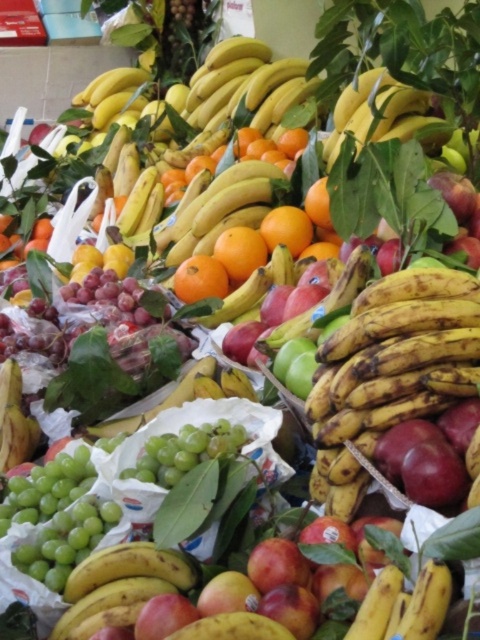
Is point (96, 561) farther from viewer compared to point (425, 115)?

No, it is in front of (425, 115).

Between yellow matte bananas at lower left and yellow matte bananas at center, which one is positioned lower?

Positioned lower is yellow matte bananas at lower left.

Which is in front, point (116, 577) or point (367, 124)?

Point (116, 577) is more forward.

You are a GUI agent. You are given a task and a screenshot of the screen. Output one action in this format:
    pyautogui.click(x=<x>, y=<y>)
    Task: Click on the yellow matte bananas at lower left
    This screenshot has height=640, width=480.
    Given the screenshot: What is the action you would take?
    pyautogui.click(x=120, y=586)

Can you confirm if ripe yellow bananas at center is smaller than yellow matte bananas at center?

Yes, ripe yellow bananas at center is smaller than yellow matte bananas at center.

Between point (404, 276) and point (348, 113), which one is positioned behind?

Positioned behind is point (348, 113).

Between point (330, 376) and point (360, 90), which one is positioned behind?

The point (360, 90) is behind.

I want to click on ripe yellow bananas at center, so click(389, 371).

Measure the distance between point (370,380) and camera.

The distance of point (370,380) from camera is 4.68 feet.

Which is behind, point (343, 513) or point (172, 580)?

Positioned behind is point (343, 513).

In order to click on ripe yellow bananas at center in this screenshot , I will do `click(389, 371)`.

Locate an element on the screen. ripe yellow bananas at center is located at coordinates (389, 371).